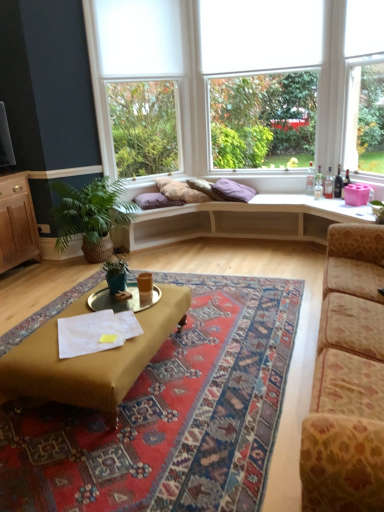
Image resolution: width=384 pixels, height=512 pixels. Find the location of `free location to the right of mustard fabric coffee table at center`. free location to the right of mustard fabric coffee table at center is located at coordinates pos(224,381).